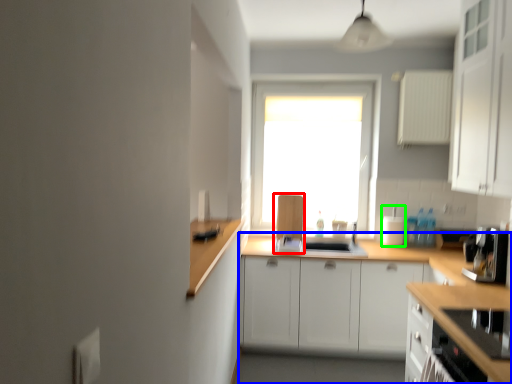
Question: Based on their relative distances, which object is nearer to appliance (highlighted by a red box)? Choose from countertop (highlighted by a blue box) and appliance (highlighted by a green box).

Choices:
 (A) countertop
 (B) appliance

Answer: (A)